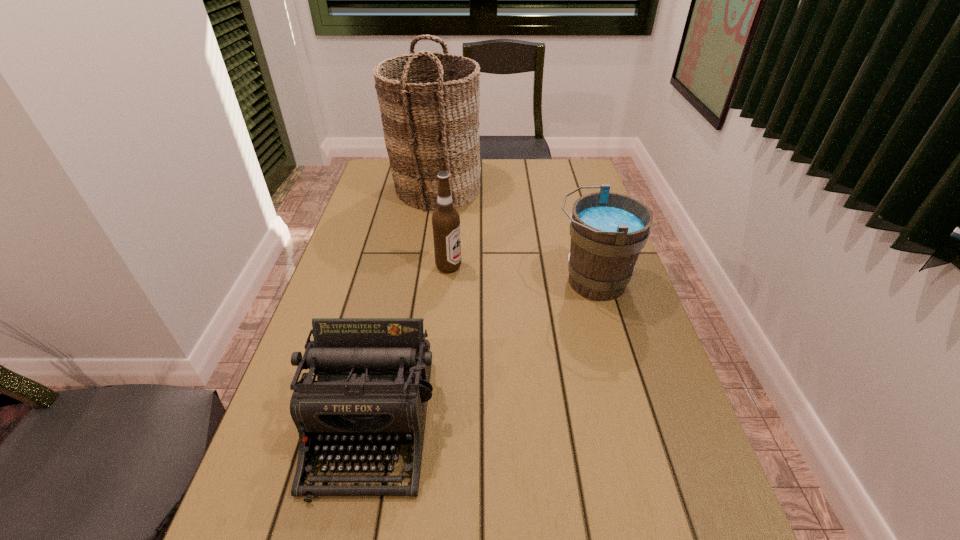
The image size is (960, 540). I want to click on the farthest object, so click(x=429, y=126).

Identify the location of basket. This screenshot has width=960, height=540. (429, 126).

Find the location of a particular element. This screenshot has height=540, width=960. the third shortest object is located at coordinates (445, 220).

Locate an element on the screen. the second shortest object is located at coordinates (608, 230).

Find the location of a particular element. the rightmost object is located at coordinates (608, 230).

I want to click on typewriter, so click(x=373, y=386).

Locate an element on the screen. the shortest object is located at coordinates (373, 386).

Identify the location of free region located 0.300m on the front of the farthest object. (x=423, y=272).

I want to click on vacant space located 0.340m on the label of the alcohol, so click(x=580, y=266).

Where is `vacant space located 0.400m with a handle on the side of the second shortest object`? This screenshot has height=540, width=960. vacant space located 0.400m with a handle on the side of the second shortest object is located at coordinates (406, 282).